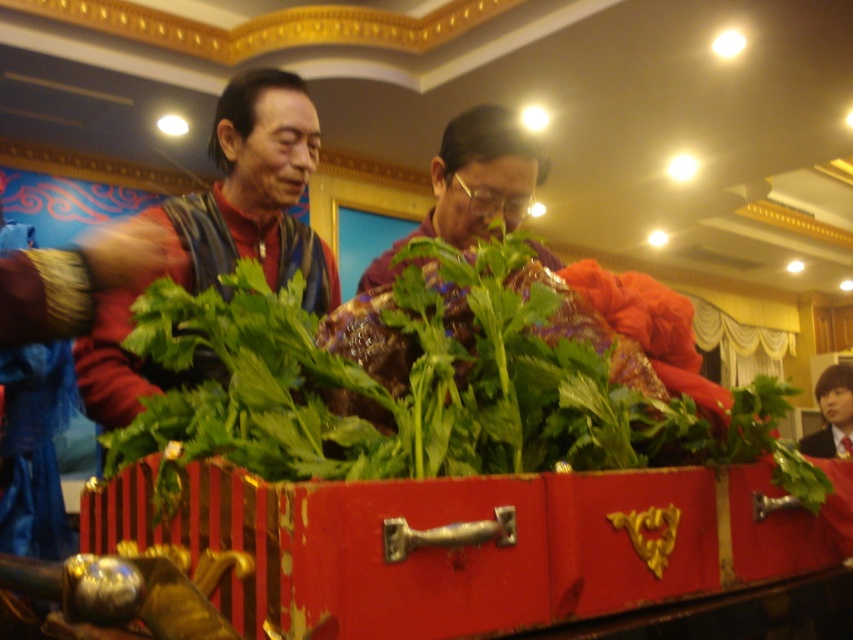
Please look at the image and locate the point at coordinates (437, 381). What object is this point located on?

The point at coordinates (437, 381) is located on the green leafy vegetable at center.

You are a guest at the event and want to take a photo of the green leafy vegetable at center and the matte black vest at left. Based on their positions, which object should you focus on first to ensure both are in the frame?

The matte black vest at left should be focused on first since the green leafy vegetable at center is positioned to its right, ensuring both are included when framing from the left side.